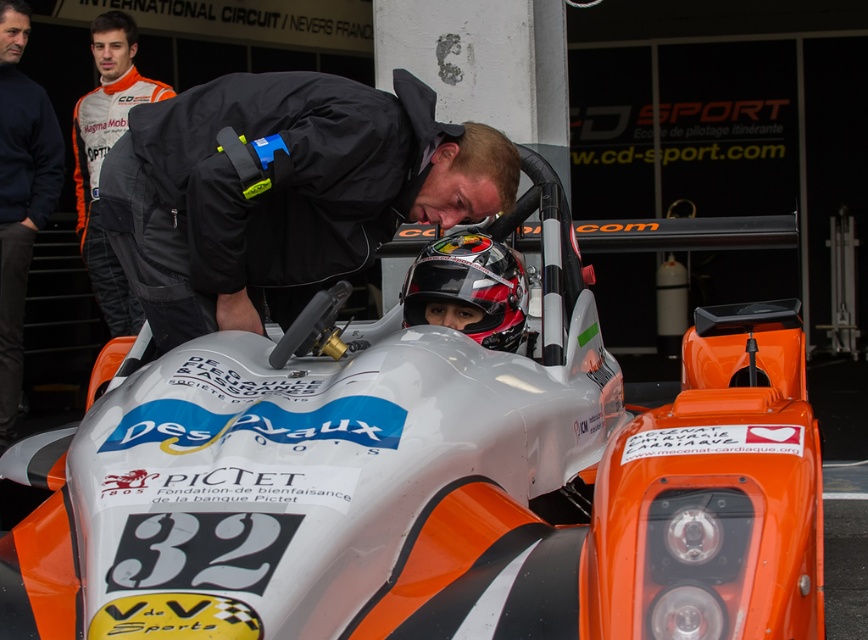
Question: Is the position of black matte jacket at center less distant than that of orange/white racing suit at upper left?

Choices:
 (A) yes
 (B) no

Answer: (A)

Question: Which point is closer to the camera?

Choices:
 (A) (20, 358)
 (B) (120, 77)
 (C) (459, 240)

Answer: (C)

Question: Does black matte jacket at center lie in front of shiny black helmet at center?

Choices:
 (A) no
 (B) yes

Answer: (B)

Question: Does black matte jacket at center appear under navy blue sweatshirt at left?

Choices:
 (A) yes
 (B) no

Answer: (A)

Question: Which of the following is the closest to the observer?

Choices:
 (A) orange matte race car at center
 (B) navy blue sweatshirt at left
 (C) shiny black helmet at center

Answer: (A)

Question: Estimate the real-world distances between objects in this image. Which object is closer to the orange matte race car at center?

Choices:
 (A) navy blue sweatshirt at left
 (B) black matte jacket at center

Answer: (B)